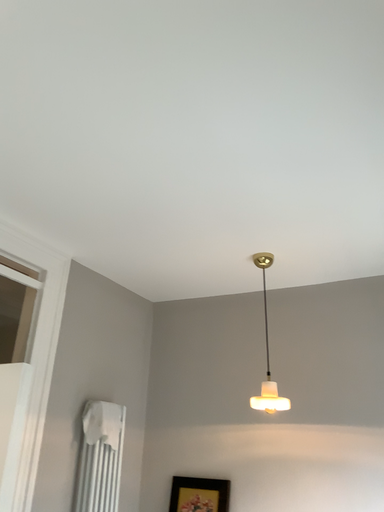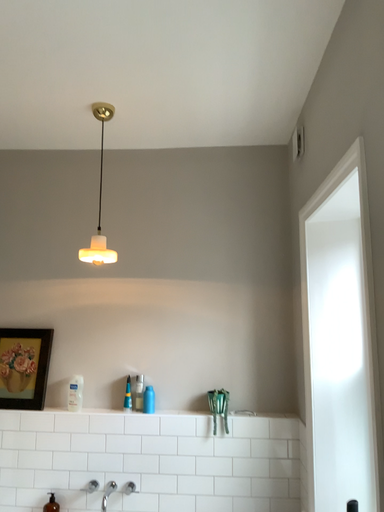
Question: How did the camera likely rotate when shooting the video?

Choices:
 (A) rotated downward
 (B) rotated upward

Answer: (A)